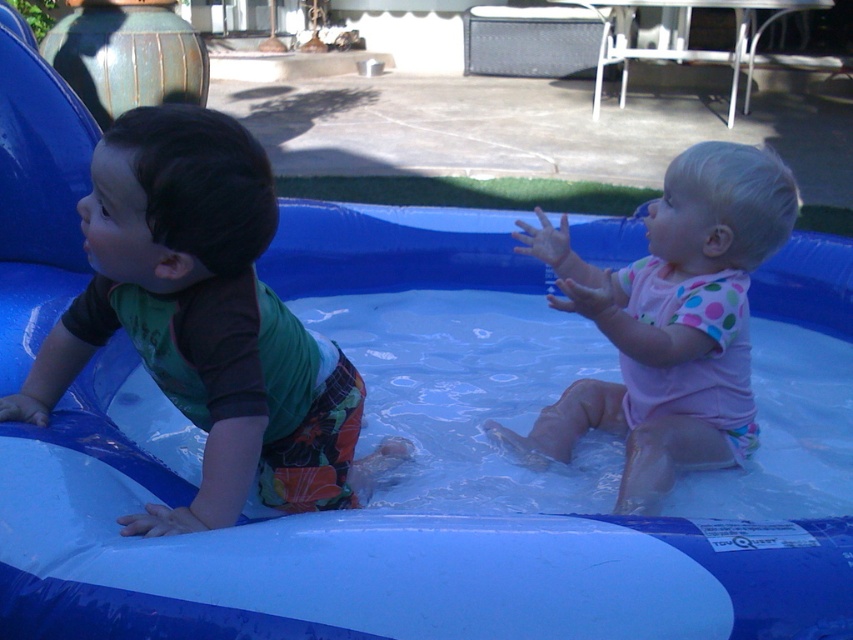
You are a photographer trying to capture a clear photo of both the blue rubber pool at center and the pink polka dot swimsuit at center. Which object is positioned closer to the camera lens?

The blue rubber pool at center is closer to the viewer than the pink polka dot swimsuit at center, so the photographer should focus on the blue rubber pool at center first to ensure it is in clear focus.

Consider the image. You are standing at the point labeled point [770,328]. Can you see the point labeled point [221,515] directly in front of you?

Since point [770,328] is behind point [221,515], you are positioned behind point [221,515]. Therefore, the point labeled point [221,515] is in front of you, so yes, you can see it directly in front of you.